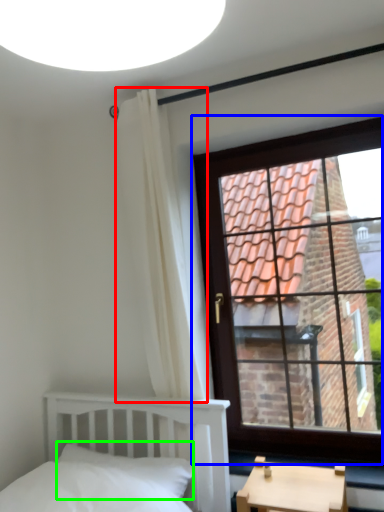
Question: Which object is positioned closest to curtain (highlighted by a red box)? Select from window (highlighted by a blue box) and pillow (highlighted by a green box).

Choices:
 (A) window
 (B) pillow

Answer: (B)